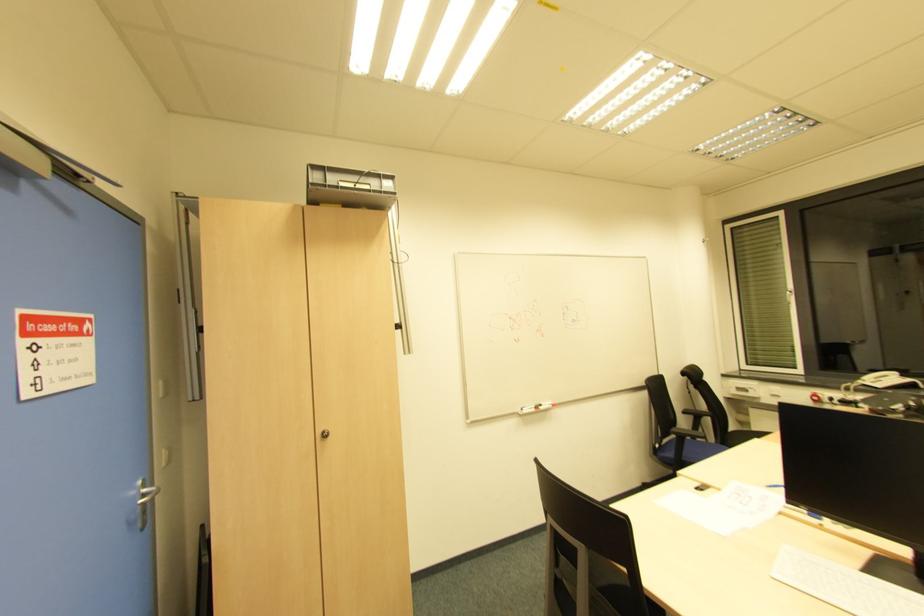
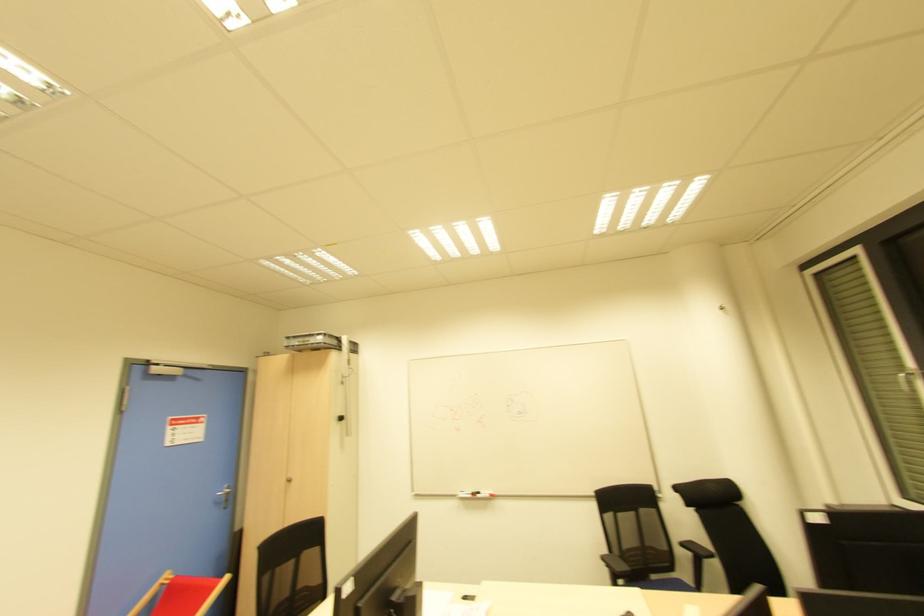
Find the pixel in the second image that matches [541,408] in the first image.

(478, 496)